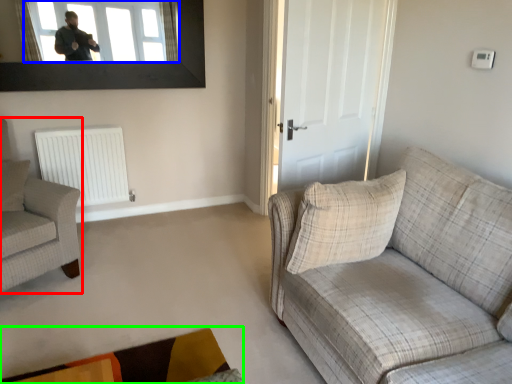
Question: Estimate the real-world distances between objects in this image. Which object is farther from chair (highlighted by a red box), window (highlighted by a blue box) or plain (highlighted by a green box)?

Choices:
 (A) window
 (B) plain

Answer: (A)